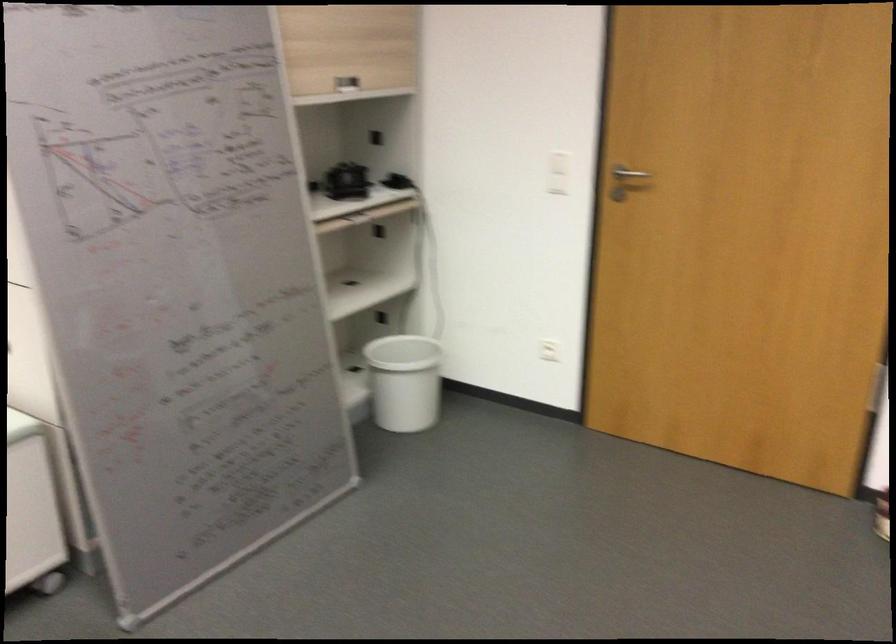
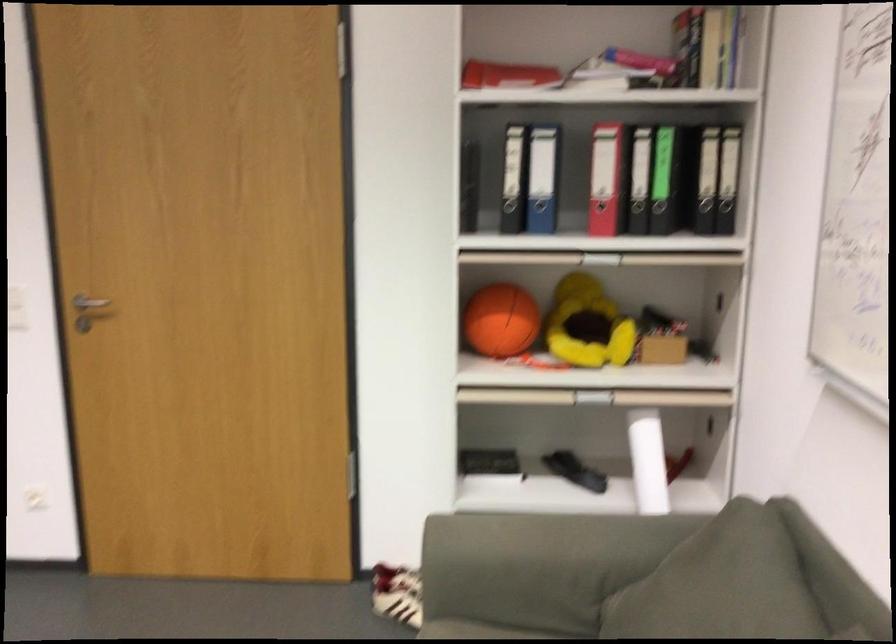
Where in the second image is the point corresponding to (645,163) from the first image?

(88, 305)